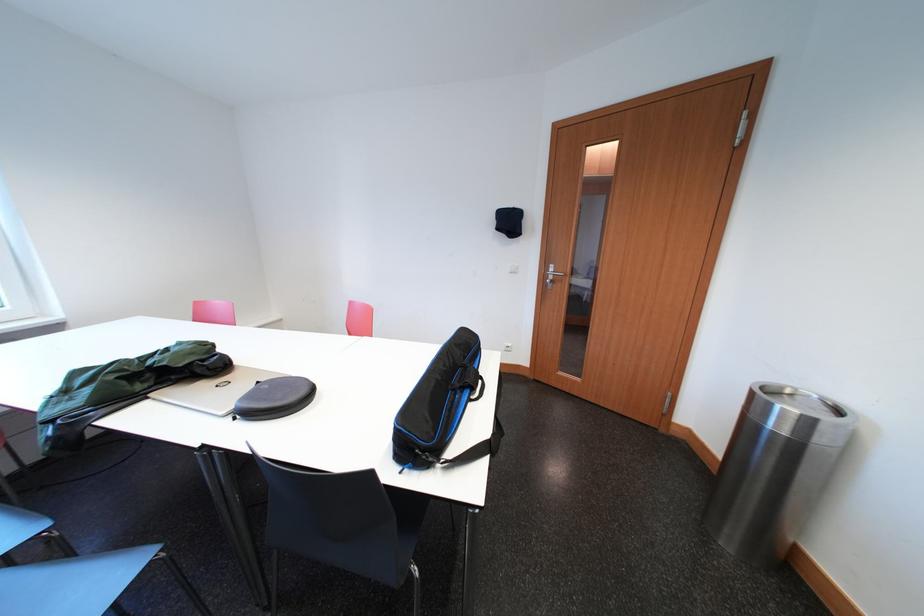
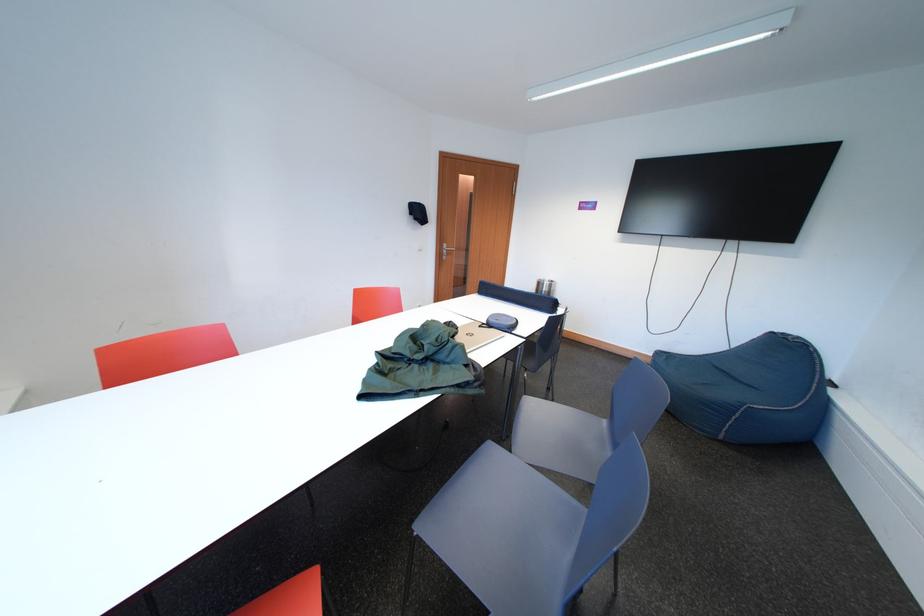
In the second image, find the point that corresponds to [268,387] in the first image.

(490, 330)